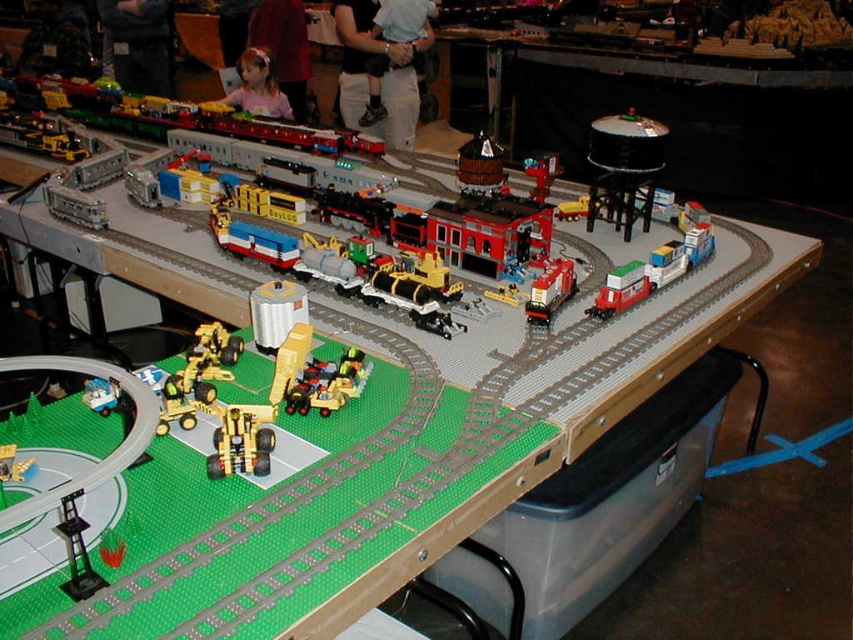
Question: Which point appears closest to the camera in this image?

Choices:
 (A) (137, 52)
 (B) (97, 381)
 (C) (556, 268)
 (D) (392, 10)

Answer: (B)

Question: Considering the relative positions of dark blue jeans at center and shiny red plastic train at center in the image provided, where is dark blue jeans at center located with respect to shiny red plastic train at center?

Choices:
 (A) left
 (B) right

Answer: (A)

Question: Does denim pants at upper center have a greater width compared to pink fabric at upper center?

Choices:
 (A) no
 (B) yes

Answer: (B)

Question: Which object is farther from the camera taking this photo?

Choices:
 (A) metallic brown train car at center
 (B) light blue shirt at center

Answer: (B)

Question: Which point is closer to the camera?

Choices:
 (A) (119, 388)
 (B) (341, 32)

Answer: (A)

Question: Observing the image, what is the correct spatial positioning of pink fabric at center in reference to metallic yellow crane at lower left?

Choices:
 (A) above
 (B) below

Answer: (A)